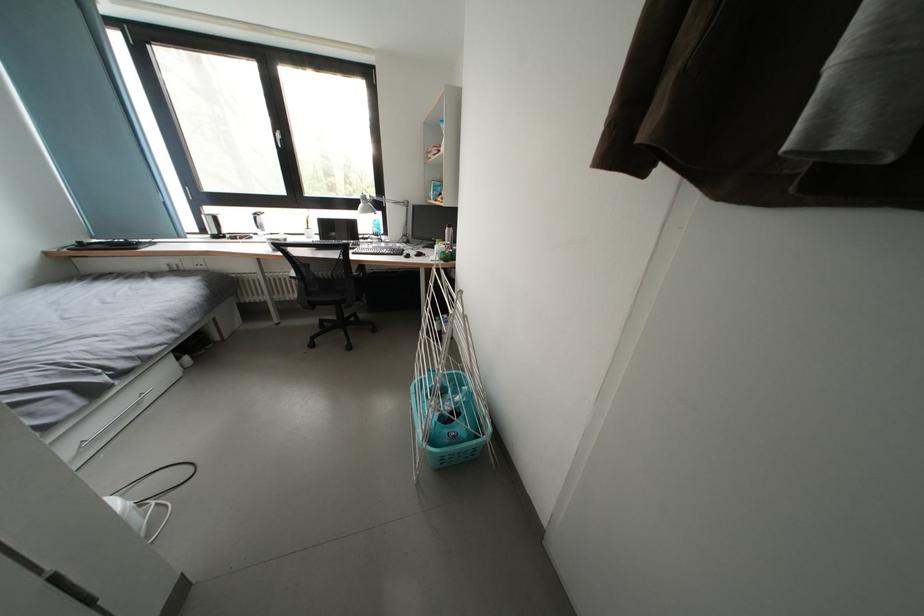
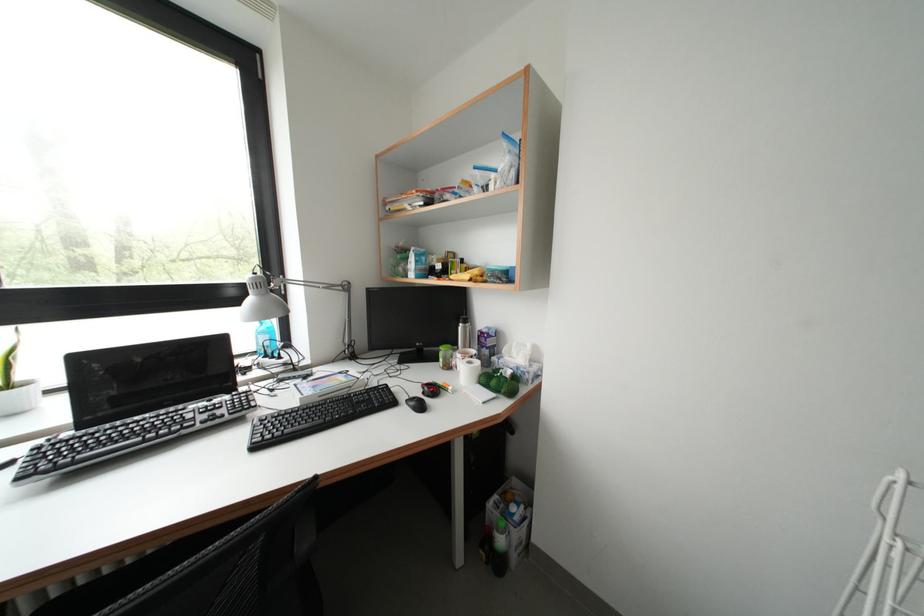
Question: I am providing you with two images of the same scene from different viewpoints. After the viewpoint changes to image2, which objects are now occluded?

Choices:
 (A) black mouse
 (B) white paper roll
 (C) red mouse
 (D) none of these

Answer: (D)